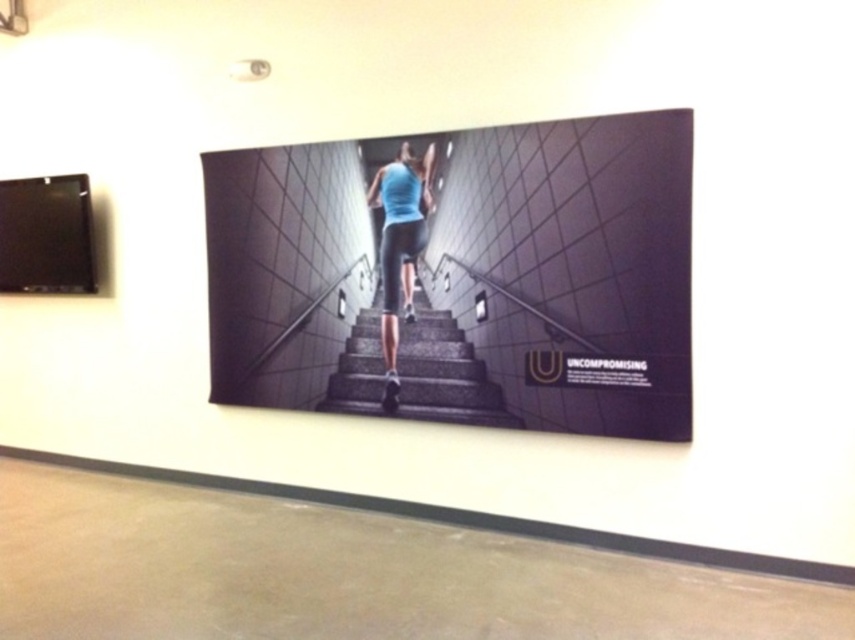
Question: Observing the image, what is the correct spatial positioning of gray concrete stairs at center in reference to blue fabric leggings at center?

Choices:
 (A) below
 (B) above

Answer: (A)

Question: Among these objects, which one is nearest to the camera?

Choices:
 (A) gray concrete stairs at center
 (B) blue fabric leggings at center

Answer: (A)

Question: Is gray concrete stairs at center below blue fabric leggings at center?

Choices:
 (A) yes
 (B) no

Answer: (A)

Question: Is the position of gray concrete stairs at center less distant than that of blue fabric leggings at center?

Choices:
 (A) no
 (B) yes

Answer: (B)

Question: Which object appears closest to the camera in this image?

Choices:
 (A) gray concrete stairs at center
 (B) blue fabric leggings at center

Answer: (A)

Question: Which point appears farthest from the camera in this image?

Choices:
 (A) (388, 371)
 (B) (321, 404)

Answer: (B)